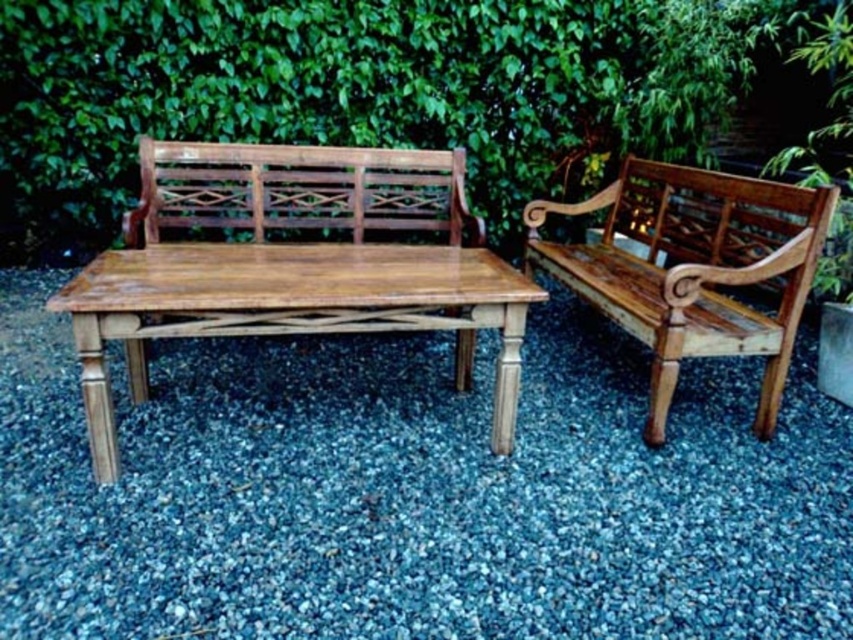
Question: Which object is the closest to the smooth gray gravel at center?

Choices:
 (A) teak wood bench at right
 (B) light brown wood bench at center
 (C) teak wood bench at center

Answer: (B)

Question: Which is farther from the smooth gray gravel at center?

Choices:
 (A) teak wood bench at center
 (B) light brown wood bench at center

Answer: (A)

Question: Observing the image, what is the correct spatial positioning of light brown wood bench at center in reference to teak wood bench at right?

Choices:
 (A) above
 (B) below

Answer: (B)

Question: Considering the relative positions of smooth gray gravel at center and teak wood bench at right in the image provided, where is smooth gray gravel at center located with respect to teak wood bench at right?

Choices:
 (A) right
 (B) left

Answer: (B)

Question: Which point is farther to the camera?

Choices:
 (A) teak wood bench at center
 (B) teak wood bench at right
 (C) light brown wood bench at center

Answer: (A)

Question: Is teak wood bench at right smaller than teak wood bench at center?

Choices:
 (A) no
 (B) yes

Answer: (A)